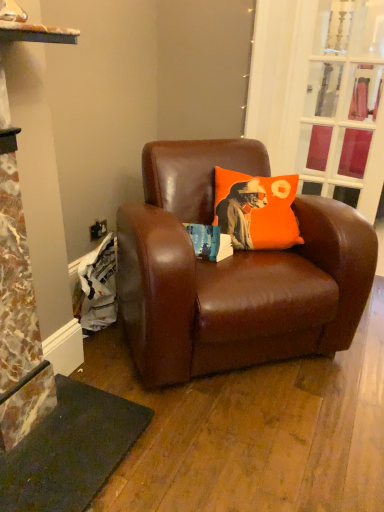
Question: Can you confirm if orange fabric pillow at center is positioned to the right of brown leather chair at center?

Choices:
 (A) no
 (B) yes

Answer: (B)

Question: Could you tell me if orange fabric pillow at center is turned towards brown leather chair at center?

Choices:
 (A) yes
 (B) no

Answer: (A)

Question: From the image's perspective, is orange fabric pillow at center located above brown leather chair at center?

Choices:
 (A) yes
 (B) no

Answer: (A)

Question: Does orange fabric pillow at center have a greater height compared to brown leather chair at center?

Choices:
 (A) no
 (B) yes

Answer: (A)

Question: Is the position of orange fabric pillow at center less distant than that of brown leather chair at center?

Choices:
 (A) yes
 (B) no

Answer: (B)

Question: Is orange fabric pillow at center shorter than brown leather chair at center?

Choices:
 (A) yes
 (B) no

Answer: (A)

Question: From the image's perspective, does brown leather chair at center appear lower than orange fabric pillow at center?

Choices:
 (A) yes
 (B) no

Answer: (A)

Question: Is brown leather chair at center smaller than orange fabric pillow at center?

Choices:
 (A) yes
 (B) no

Answer: (B)

Question: Is brown leather chair at center touching orange fabric pillow at center?

Choices:
 (A) yes
 (B) no

Answer: (B)

Question: Are brown leather chair at center and orange fabric pillow at center located far from each other?

Choices:
 (A) no
 (B) yes

Answer: (A)

Question: Does brown leather chair at center have a lesser height compared to orange fabric pillow at center?

Choices:
 (A) yes
 (B) no

Answer: (B)

Question: From a real-world perspective, is brown leather chair at center physically above orange fabric pillow at center?

Choices:
 (A) yes
 (B) no

Answer: (B)

Question: Considering the relative positions of clear glass door at upper right and orange fabric pillow at center in the image provided, is clear glass door at upper right to the right of orange fabric pillow at center from the viewer's perspective?

Choices:
 (A) yes
 (B) no

Answer: (A)